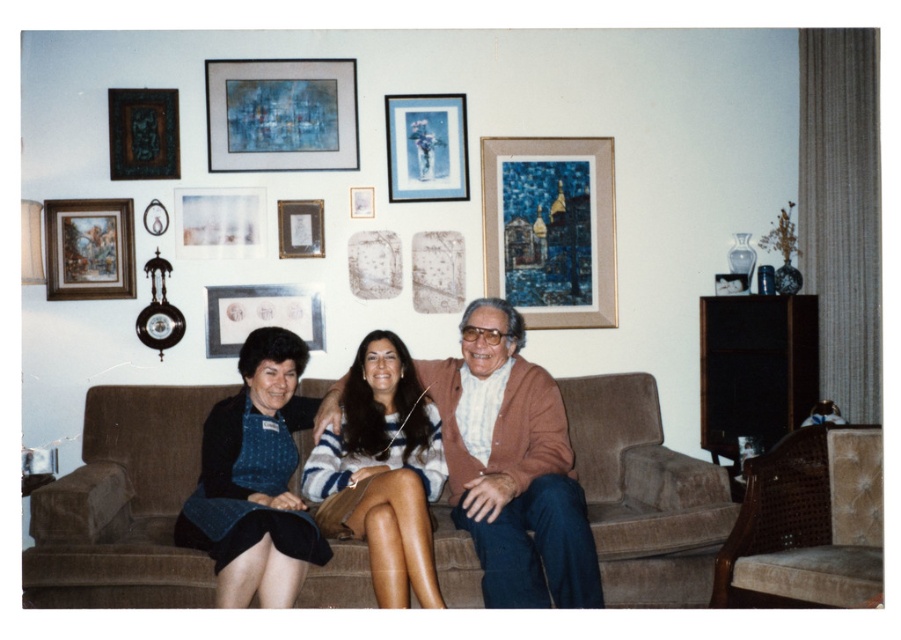
You are organizing a photo shoot in the living room and need to position a model near the brown wool sweater at center and the wooden framed painting at upper right. Based on their positions, which object is closer to the left side of the room?

The brown wool sweater at center is closer to the left side of the room because it is positioned to the left of the wooden framed painting at upper right.

You are organizing a photo shoot in this living room and need to place a 10cm thick prop between the brown wool sweater at center and the wooden framed painting at upper right. Will the prop fit between them?

The brown wool sweater at center is thinner than the wooden framed painting at upper right, so the 10cm thick prop can fit between them as long as the distance between the two objects allows it. However, the exact placement depends on their spatial arrangement not specified here.